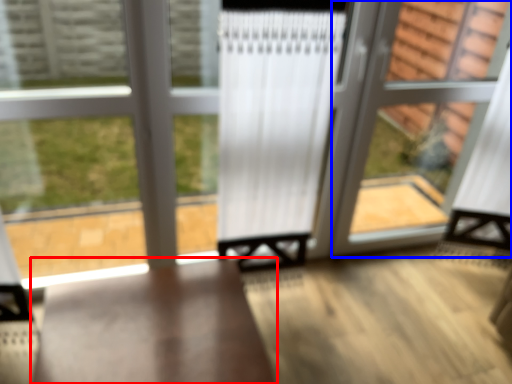
Question: Which object is closer to the camera taking this photo, furniture (highlighted by a red box) or screen door (highlighted by a blue box)?

Choices:
 (A) furniture
 (B) screen door

Answer: (A)